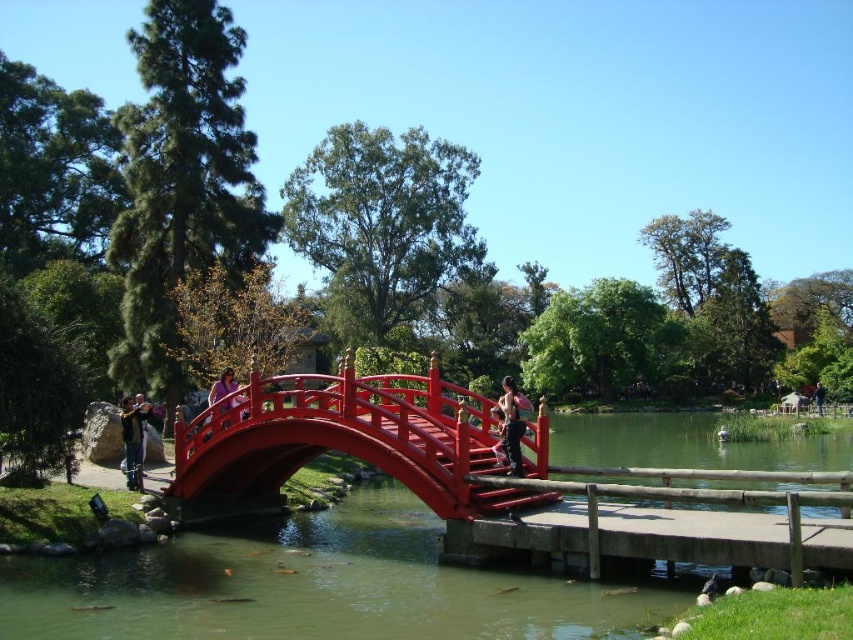
You are standing at the red wooden bridge and want to take a photo of both the point at coordinates point (518, 396) and the point at coordinates point (228, 404). Which point should you focus on first to ensure both are in the frame?

You should focus on point (518, 396) first because it is in front of point (228, 404), ensuring both can be captured in the photo.

You are standing at the center of the image and want to locate the glossy wood bridge at center. Which direction should you look to find it?

The glossy wood bridge at center is located at point 0.692 on the x axis and 0.400 on the y axis. Since you are at the center of the image, which is point 0.5 on both axes, you should look to the right and slightly downward to find the glossy wood bridge at center.

You are standing at the entrance of the park and want to reach the wooden dock at center. Based on the coordinates provided, in which direction should you walk to reach it?

The wooden dock at center is located at coordinates point (663, 520), so you should walk towards the direction of the red wooden bridge to reach it.